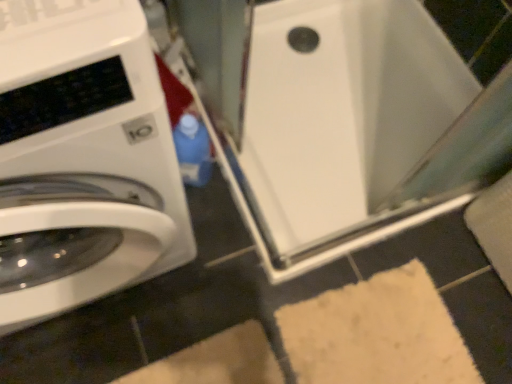
Question: Considering the relative sizes of white glossy water heater at center and white glossy washing machine at left in the image provided, is white glossy water heater at center smaller than white glossy washing machine at left?

Choices:
 (A) no
 (B) yes

Answer: (B)

Question: From a real-world perspective, does white glossy water heater at center stand above white glossy washing machine at left?

Choices:
 (A) yes
 (B) no

Answer: (B)

Question: Is the depth of white glossy water heater at center greater than that of white glossy washing machine at left?

Choices:
 (A) no
 (B) yes

Answer: (B)

Question: From a real-world perspective, is white glossy water heater at center under white glossy washing machine at left?

Choices:
 (A) yes
 (B) no

Answer: (A)

Question: Considering the relative sizes of white glossy water heater at center and white glossy washing machine at left in the image provided, is white glossy water heater at center thinner than white glossy washing machine at left?

Choices:
 (A) yes
 (B) no

Answer: (B)

Question: From the image's perspective, is white glossy water heater at center on white glossy washing machine at left?

Choices:
 (A) yes
 (B) no

Answer: (A)

Question: Is white glossy washing machine at left oriented away from white glossy water heater at center?

Choices:
 (A) yes
 (B) no

Answer: (B)

Question: Is white glossy washing machine at left oriented towards white glossy water heater at center?

Choices:
 (A) yes
 (B) no

Answer: (B)

Question: From a real-world perspective, is white glossy washing machine at left under white glossy water heater at center?

Choices:
 (A) yes
 (B) no

Answer: (B)

Question: Can you confirm if white glossy washing machine at left is wider than white glossy water heater at center?

Choices:
 (A) no
 (B) yes

Answer: (A)

Question: Is white glossy washing machine at left beside white glossy water heater at center?

Choices:
 (A) yes
 (B) no

Answer: (B)

Question: From a real-world perspective, is white glossy washing machine at left located higher than white glossy water heater at center?

Choices:
 (A) yes
 (B) no

Answer: (A)

Question: Looking at their shapes, would you say white glossy washing machine at left is wider or thinner than white glossy water heater at center?

Choices:
 (A) wide
 (B) thin

Answer: (B)